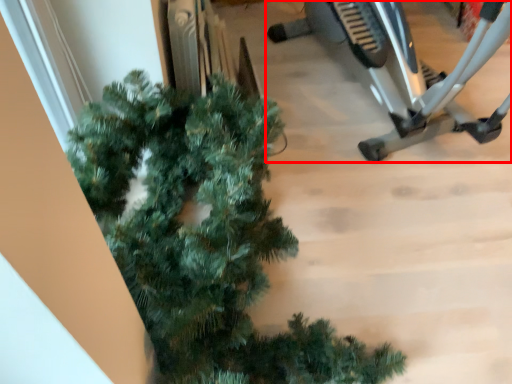
Question: From the image's perspective, what is the correct spatial positioning of stationary bicycle (annotated by the red box) in reference to christmas tree?

Choices:
 (A) below
 (B) above

Answer: (B)